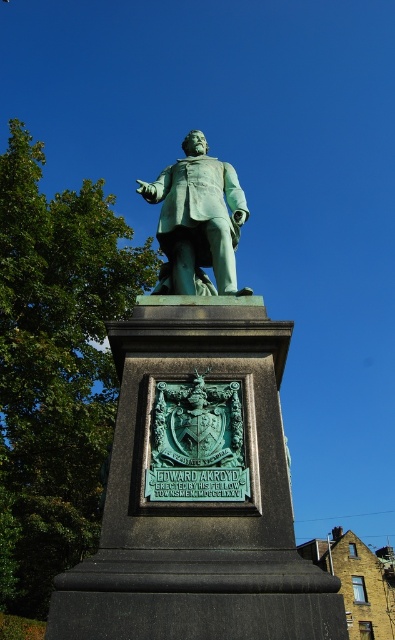
Question: Can you confirm if green patina statue at center is positioned above green patinated statue at center?

Choices:
 (A) no
 (B) yes

Answer: (A)

Question: Which object is closer to the camera taking this photo?

Choices:
 (A) green patinated statue at center
 (B) green patina statue at center

Answer: (B)

Question: Does green patina statue at center appear on the left side of green patinated statue at center?

Choices:
 (A) yes
 (B) no

Answer: (A)

Question: Among these objects, which one is nearest to the camera?

Choices:
 (A) green patina statue at center
 (B) green patinated statue at center

Answer: (A)

Question: Is green patina statue at center bigger than green patinated statue at center?

Choices:
 (A) yes
 (B) no

Answer: (A)